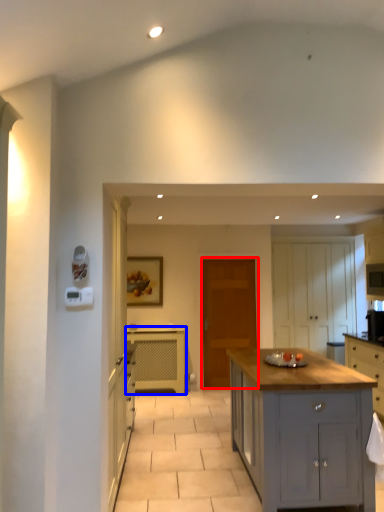
Question: Which point is further to the camera, door (highlighted by a red box) or cabinetry (highlighted by a blue box)?

Choices:
 (A) door
 (B) cabinetry

Answer: (A)